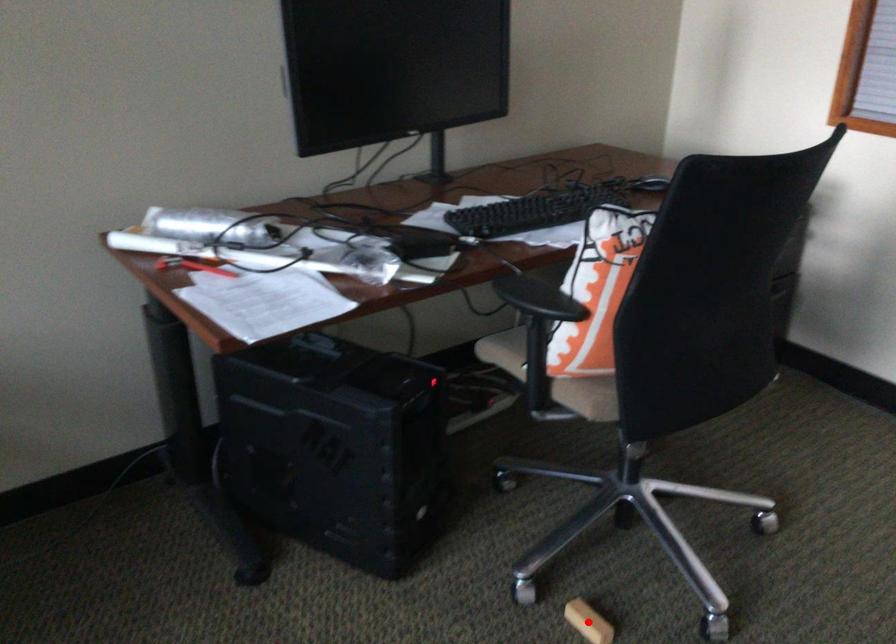
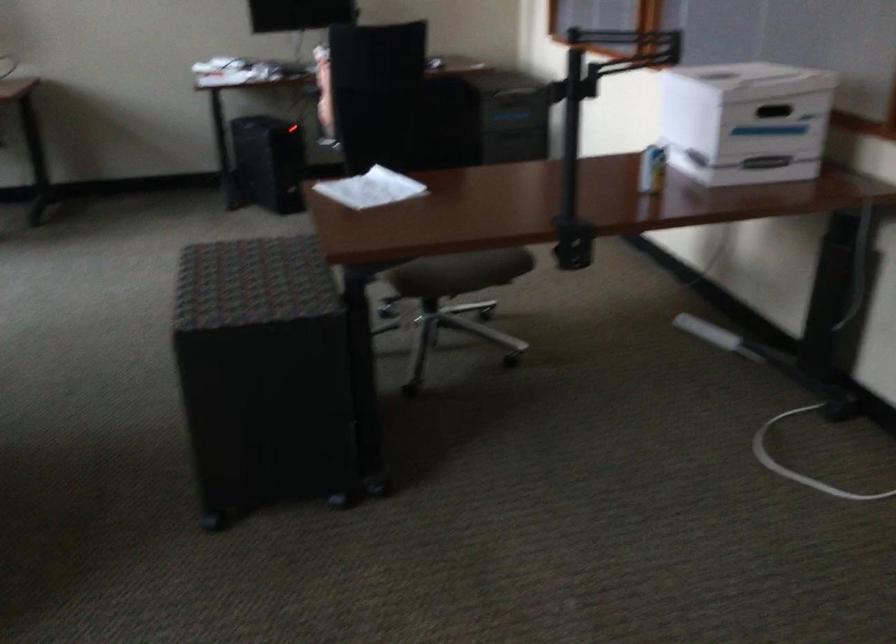
Question: I am providing you with two images of the same scene from different viewpoints. A red point is marked on the first image. Can you still see the location of the red point in image 2?

Choices:
 (A) Yes
 (B) No

Answer: (B)